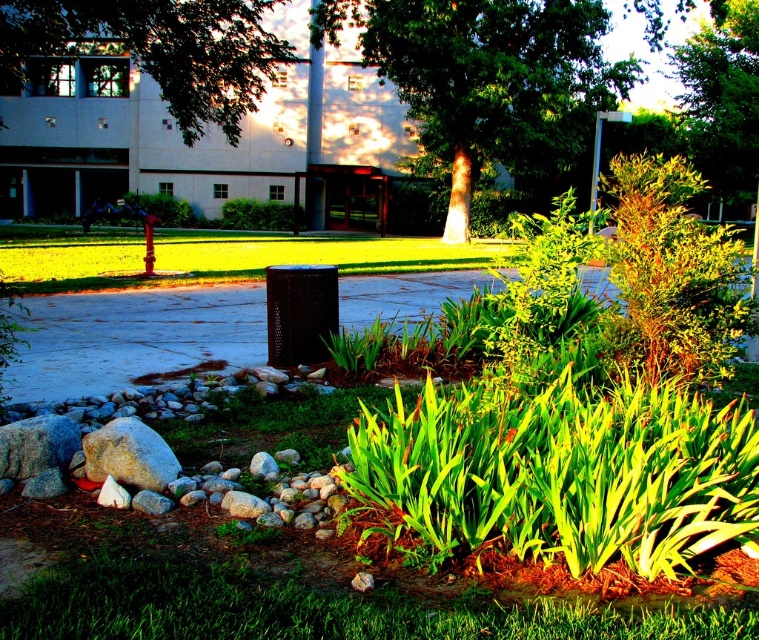
Question: Is green grass at lower center thinner than green leafy tree at upper center?

Choices:
 (A) yes
 (B) no

Answer: (A)

Question: Estimate the real-world distances between objects in this image. Which object is farther from the green leafy tree at center?

Choices:
 (A) green leafy tree at upper center
 (B) green grass at lower center
 (C) green leafy tree at upper left

Answer: (B)

Question: Is the position of green leafy tree at center less distant than that of green leafy tree at upper center?

Choices:
 (A) no
 (B) yes

Answer: (B)

Question: Which object appears closest to the camera in this image?

Choices:
 (A) green leafy tree at upper center
 (B) green grass at lower center
 (C) green leafy tree at upper left
 (D) green leafy tree at center

Answer: (B)

Question: Does green leafy tree at center have a greater width compared to green leafy tree at upper left?

Choices:
 (A) no
 (B) yes

Answer: (A)

Question: Which of the following is the closest to the observer?

Choices:
 (A) (5, 1)
 (B) (710, 67)
 (C) (458, 113)
 (D) (587, 620)

Answer: (D)